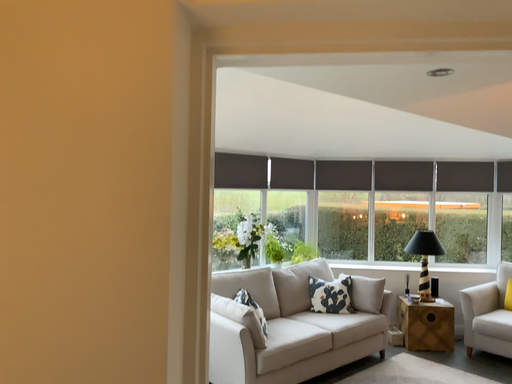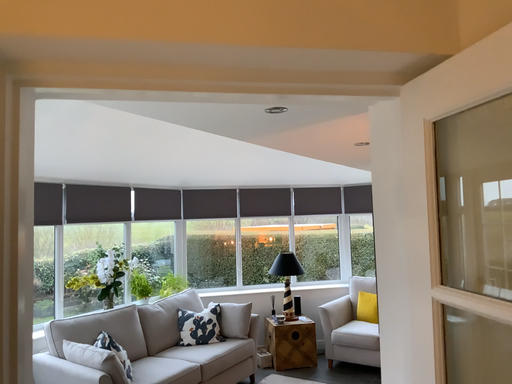
Question: Which way did the camera rotate in the video?

Choices:
 (A) rotated left
 (B) rotated right

Answer: (B)